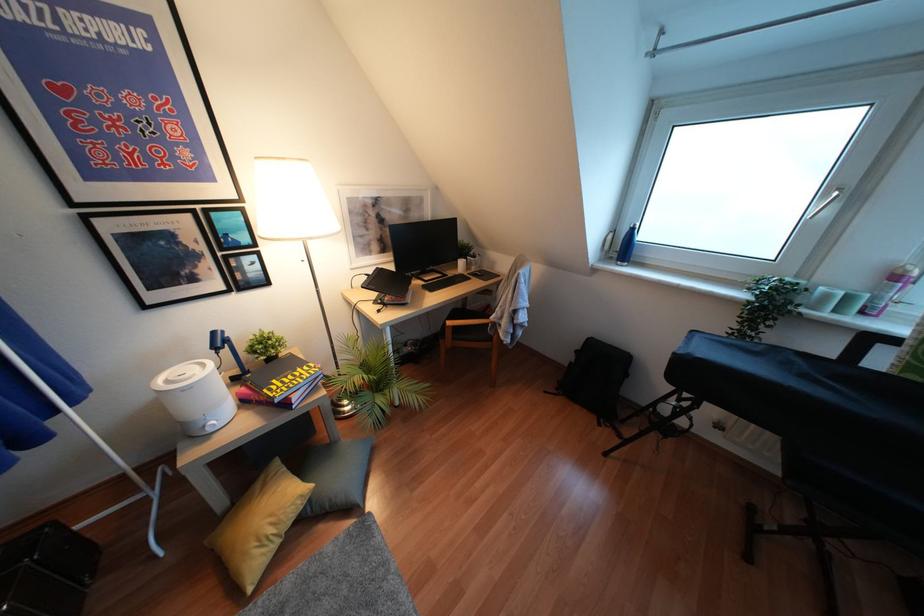
Where is `computer mouse`? computer mouse is located at coordinates (481, 274).